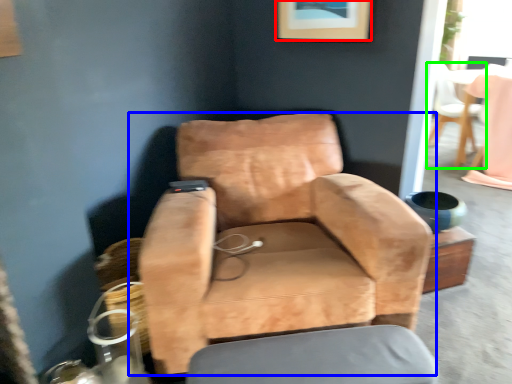
Question: Which object is the farthest from picture frame (highlighted by a red box)? Choose among these: chair (highlighted by a blue box) or chair (highlighted by a green box).

Choices:
 (A) chair
 (B) chair

Answer: (B)